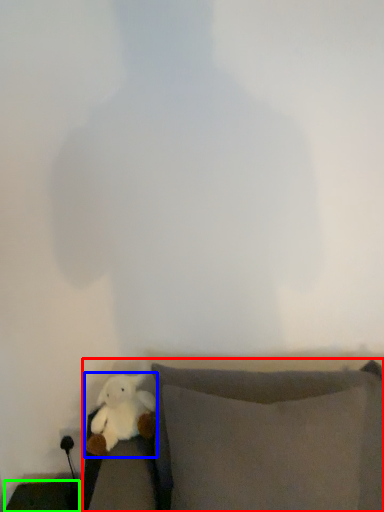
Question: Which object is the closest to the furniture (highlighted by a red box)? Choose among these: toy (highlighted by a blue box) or furniture (highlighted by a green box).

Choices:
 (A) toy
 (B) furniture

Answer: (A)